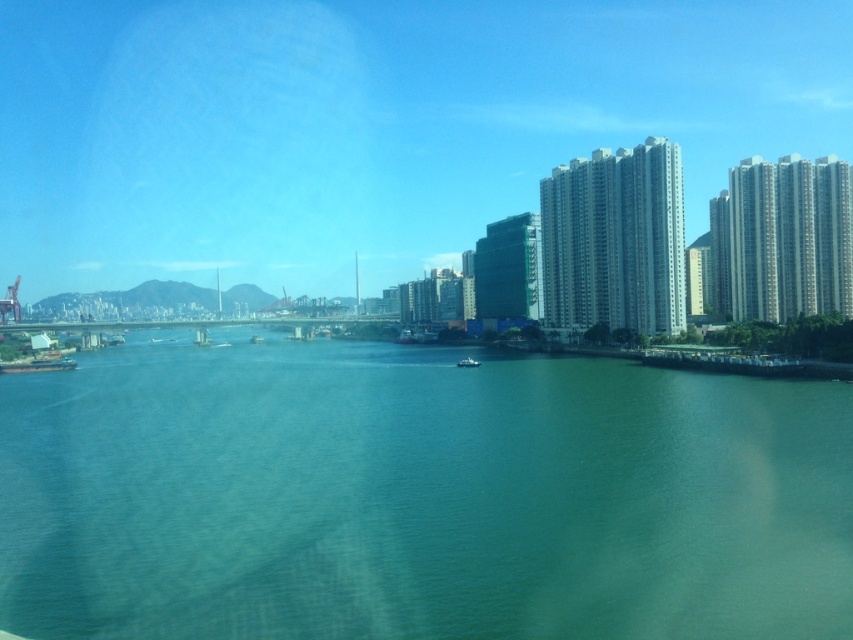
You are standing at the point with coordinates point [250,536] and want to walk towards the point [469,362]. According to the scene description, will you be moving towards the bridge or away from it?

Since point [250,536] is in front of point [469,362], you are moving away from the bridge as you walk towards point [469,362].

You are a photographer standing at the waterfront and want to capture both the green water at center and the white matte boat at center in a single shot. Which object should you position closer to the left side of your camera frame to ensure they are both visible?

To ensure both the green water at center and the white matte boat at center are visible in your shot, position the green water at center on the left side of your frame since it is already positioned on the left side of the white matte boat at center.